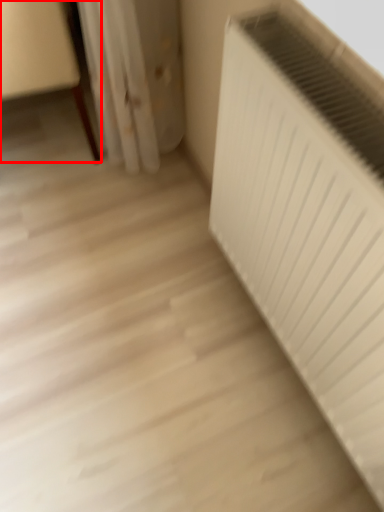
Question: From the image's perspective, where is furniture (annotated by the red box) located in relation to radiator in the image?

Choices:
 (A) below
 (B) above

Answer: (B)